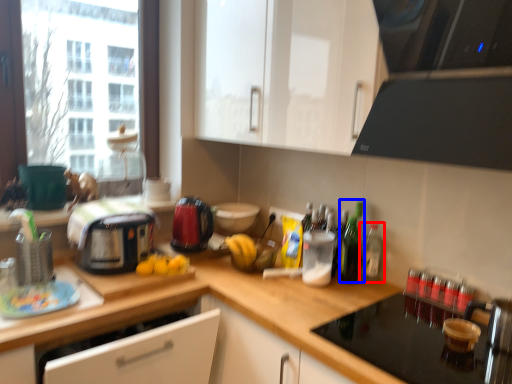
Question: Which object is further to the camera taking this photo, bottle (highlighted by a red box) or bottle (highlighted by a blue box)?

Choices:
 (A) bottle
 (B) bottle

Answer: (A)